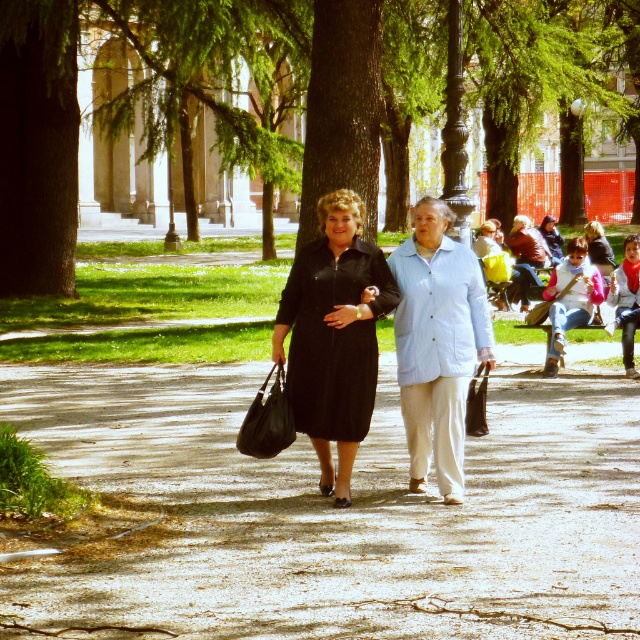
Is dull concrete pavement at center thinner than green leafy tree at center?

Correct, dull concrete pavement at center's width is less than green leafy tree at center's.

Is point (384, 513) closer to camera compared to point (372, 129)?

Yes, it is in front of point (372, 129).

Where is `dull concrete pavement at center`? dull concrete pavement at center is located at coordinates (333, 509).

Which is in front, point (328, 100) or point (336, 189)?

Positioned in front is point (336, 189).

How far apart are green leafy tree at center and matte black dress at center?

They are 17.49 meters apart.

Does point (477, 44) come behind point (316, 378)?

Yes, it is.

The width and height of the screenshot is (640, 640). What are the coordinates of `green leafy tree at center` in the screenshot? It's located at (522, 74).

Can you confirm if green textured tree at left is positioned below matte black dress at center?

Actually, green textured tree at left is above matte black dress at center.

Find the location of a particular element. green textured tree at left is located at coordinates (36, 145).